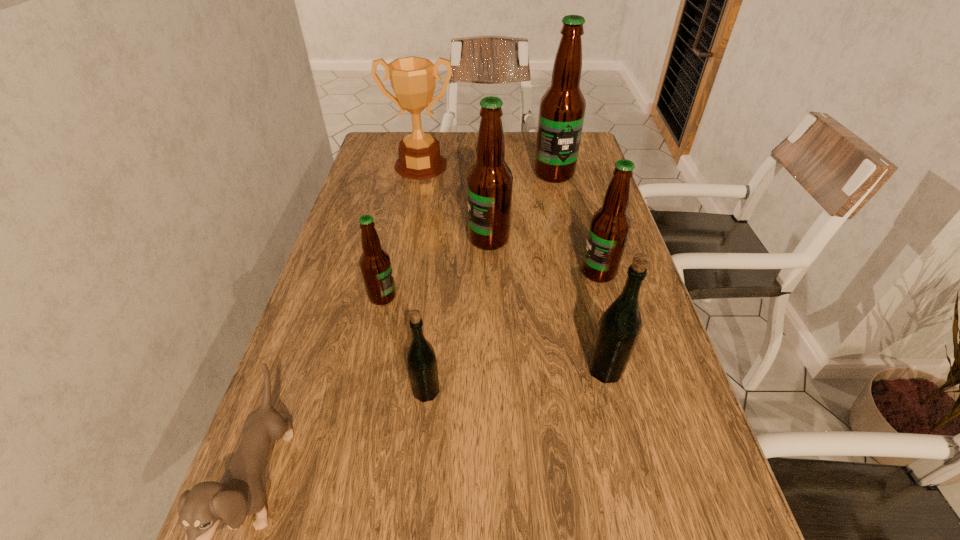
Where is `empty location between the bigger green beer bottle and the leftmost brown beer bottle`? This screenshot has width=960, height=540. empty location between the bigger green beer bottle and the leftmost brown beer bottle is located at coordinates (493, 333).

The height and width of the screenshot is (540, 960). I want to click on the second closest object to the third farthest beer bottle, so click(x=618, y=329).

I want to click on the fourth closest object to the award, so click(x=609, y=228).

Identify the location of the closest beer bottle relative to the fifth nearest object. (489, 181).

Point out which beer bottle is positioned as the sixth nearest to the award. Please provide its 2D coordinates. Your answer should be formatted as a tuple, i.e. [(x, y)], where the tuple contains the x and y coordinates of a point satisfying the conditions above.

[(618, 329)]

The height and width of the screenshot is (540, 960). I want to click on brown beer bottle that stands as the closest to the bigger green beer bottle, so click(x=609, y=228).

Locate an element on the screen. This screenshot has width=960, height=540. brown beer bottle that stands as the third closest to the biggest brown beer bottle is located at coordinates (375, 264).

You are a GUI agent. You are given a task and a screenshot of the screen. Output one action in this format:
    pyautogui.click(x=<x>, y=<y>)
    Task: Click on the free location that satisfies the following two spatial constraints: 1. on the front-facing side of the award; 2. on the label of the leftmost brown beer bottle
    
    Given the screenshot: What is the action you would take?
    [x=396, y=296]

The width and height of the screenshot is (960, 540). I want to click on vacant space that satisfies the following two spatial constraints: 1. on the label of the leftmost beer bottle; 2. on the right side of the right green beer bottle, so coord(367,370).

What are the coordinates of `free space that satisfies the following two spatial constraints: 1. on the label of the tallest beer bottle; 2. on the label of the nearest brown beer bottle` in the screenshot? It's located at (582, 296).